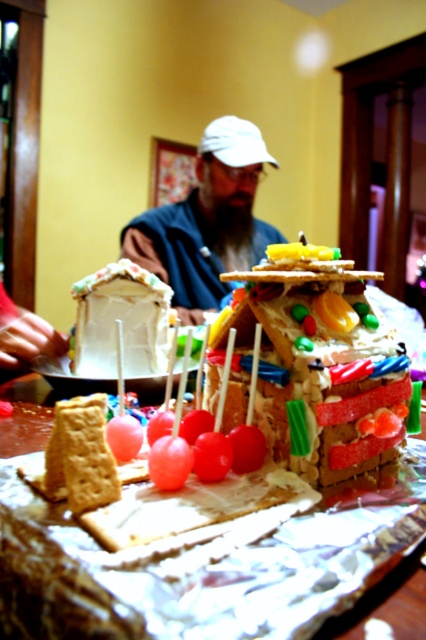
Question: Is gumdrop candy house at center above matte white cap at center?

Choices:
 (A) yes
 (B) no

Answer: (B)

Question: Which object appears farthest from the camera in this image?

Choices:
 (A) shiny aluminum foil at center
 (B) matte white cap at center
 (C) white fondant house at center
 (D) matte brown gingerbread at lower left

Answer: (B)

Question: Which point is farther to the camera?

Choices:
 (A) matte white cap at center
 (B) gumdrop candy house at center
 (C) shiny aluminum foil at center
 (D) matte brown gingerbread at lower left

Answer: (A)

Question: From the image, what is the correct spatial relationship of matte white cap at center in relation to matte brown gingerbread at lower left?

Choices:
 (A) left
 (B) right

Answer: (B)

Question: Can you confirm if gumdrop candy house at center is positioned to the right of white fondant house at center?

Choices:
 (A) no
 (B) yes

Answer: (B)

Question: Among these objects, which one is farthest from the camera?

Choices:
 (A) shiny aluminum foil at center
 (B) matte brown gingerbread at lower left
 (C) matte white cap at center
 (D) white fondant house at center

Answer: (C)